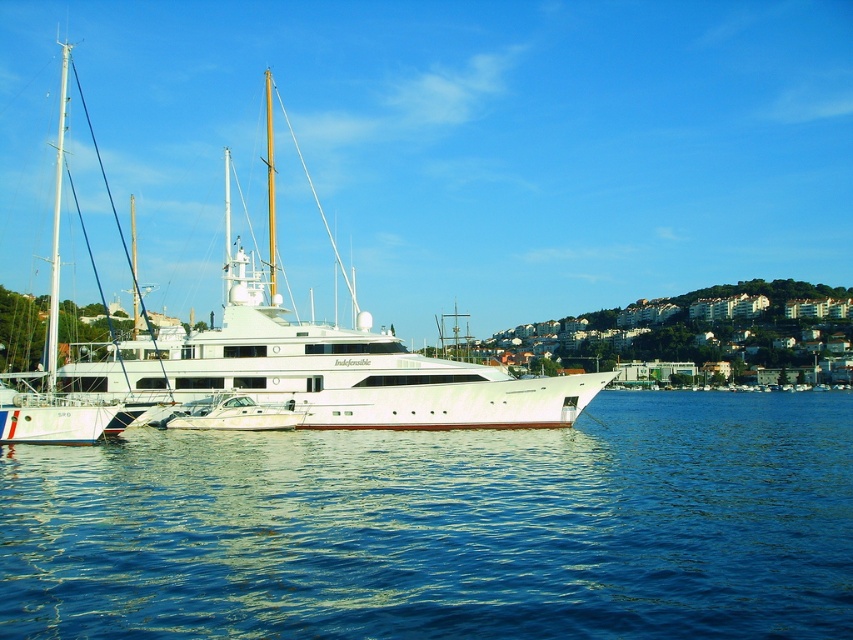
Consider the image. Does blue liquid water at lower center have a greater width compared to white glossy yacht at center?

No, blue liquid water at lower center is not wider than white glossy yacht at center.

In order to click on blue liquid water at lower center in this screenshot , I will do `click(445, 528)`.

This screenshot has height=640, width=853. Describe the element at coordinates (322, 368) in the screenshot. I see `white glossy yacht at center` at that location.

Which is more to the right, white glossy yacht at center or white matte sailboat at left?

white glossy yacht at center is more to the right.

Is point (469, 410) less distant than point (22, 378)?

That is True.

This screenshot has width=853, height=640. Identify the location of white glossy yacht at center. coord(322,368).

Is blue liquid water at lower center wider than white matte sailboat at left?

No, blue liquid water at lower center is not wider than white matte sailboat at left.

Which is more to the right, blue liquid water at lower center or white matte sailboat at left?

blue liquid water at lower center

Locate an element on the screen. blue liquid water at lower center is located at coordinates (445, 528).